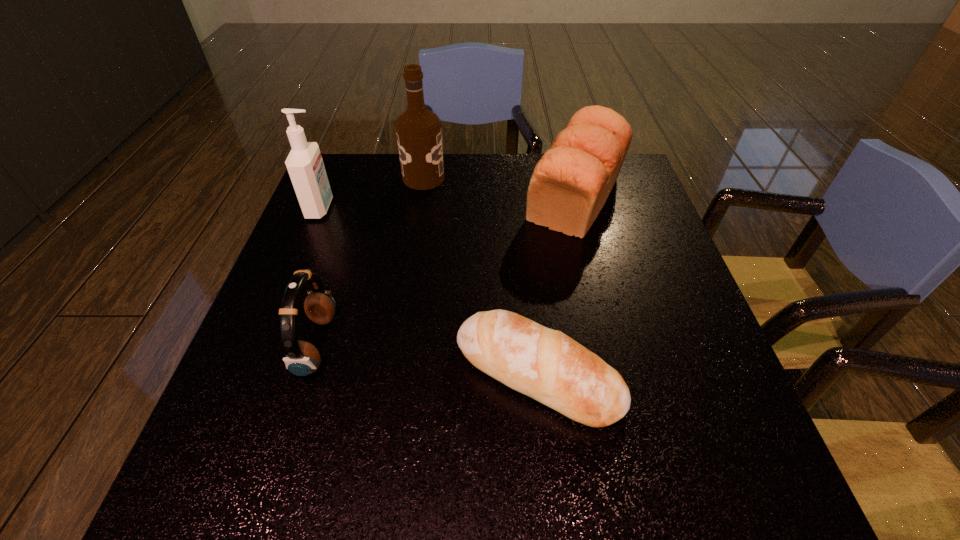
The width and height of the screenshot is (960, 540). Identify the location of free spot that satisfies the following two spatial constraints: 1. on the label of the alcohol; 2. on the left side of the farther bread. (420, 198).

Locate an element on the screen. This screenshot has width=960, height=540. blank area in the image that satisfies the following two spatial constraints: 1. on the ear cup of the fourth object from right to left; 2. on the back side of the shorter bread is located at coordinates (309, 374).

The image size is (960, 540). I want to click on vacant point that satisfies the following two spatial constraints: 1. on the label of the third object from left to right; 2. on the back side of the shortest object, so click(x=393, y=374).

Locate an element on the screen. This screenshot has width=960, height=540. vacant region that satisfies the following two spatial constraints: 1. on the front label of the shorter bread; 2. on the left side of the leftmost object is located at coordinates (252, 374).

I want to click on free region that satisfies the following two spatial constraints: 1. on the label of the third object from right to left; 2. on the left side of the third shortest object, so click(420, 198).

Where is `vacant position in the image that satisfies the following two spatial constraints: 1. on the label of the alcohol; 2. on the right side of the taller bread`? The height and width of the screenshot is (540, 960). vacant position in the image that satisfies the following two spatial constraints: 1. on the label of the alcohol; 2. on the right side of the taller bread is located at coordinates (420, 198).

The height and width of the screenshot is (540, 960). What are the coordinates of `vacant point that satisfies the following two spatial constraints: 1. on the front side of the third tallest object; 2. on the front label of the cleansing agent` in the screenshot? It's located at (578, 208).